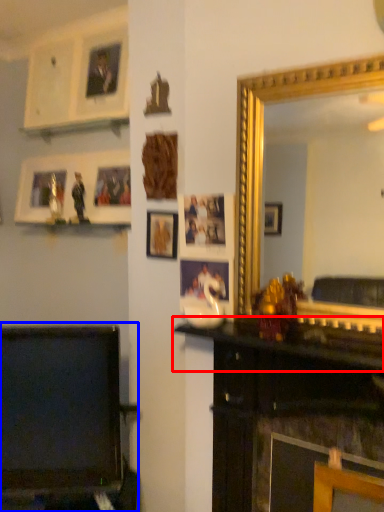
Question: Which point is closer to the camera, mantle (highlighted by a red box) or furniture (highlighted by a blue box)?

Choices:
 (A) mantle
 (B) furniture

Answer: (A)